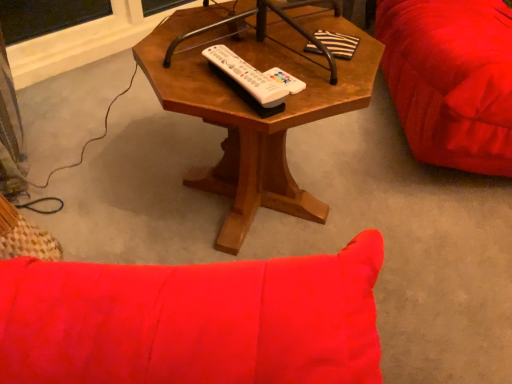
Where is `vacant space to the right of white plastic remote at center`? vacant space to the right of white plastic remote at center is located at coordinates (323, 86).